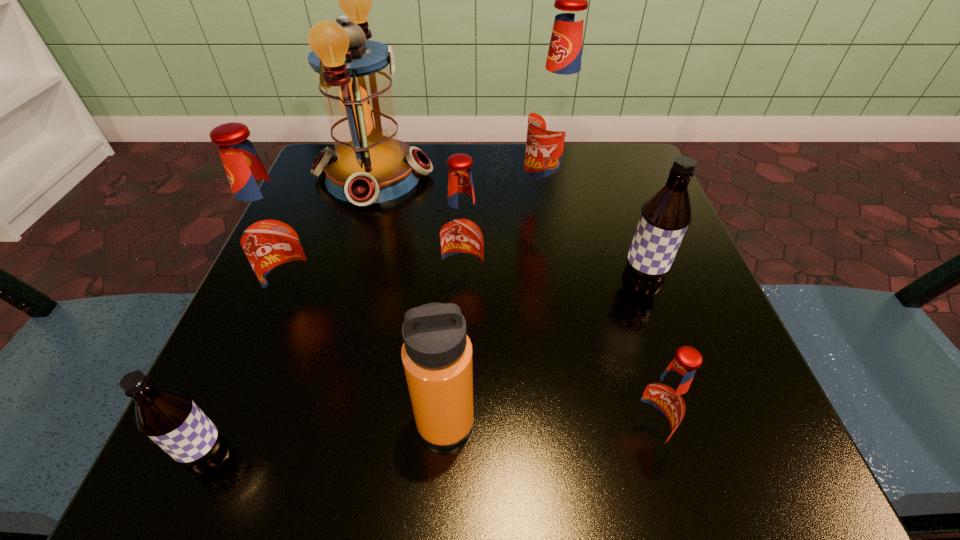
Locate an element on the screen. The height and width of the screenshot is (540, 960). free region located 0.160m on the right of the left brown root beer is located at coordinates (369, 460).

Where is `root beer at the far edge`? root beer at the far edge is located at coordinates (556, 120).

Where is `lantern situated at the far edge`? The height and width of the screenshot is (540, 960). lantern situated at the far edge is located at coordinates (369, 164).

Image resolution: width=960 pixels, height=540 pixels. I want to click on thermos bottle that is at the near edge, so pyautogui.click(x=437, y=354).

This screenshot has width=960, height=540. I want to click on lantern situated at the left edge, so click(x=369, y=164).

I want to click on object at the far left corner, so click(369, 164).

Find the location of a particular element. object present at the near left corner is located at coordinates (169, 417).

Locate an element on the screen. This screenshot has height=540, width=960. object that is at the near right corner is located at coordinates (662, 404).

Identify the location of vacant space at the far edge of the desktop. click(429, 143).

Image resolution: width=960 pixels, height=540 pixels. I want to click on free region at the left edge, so click(339, 280).